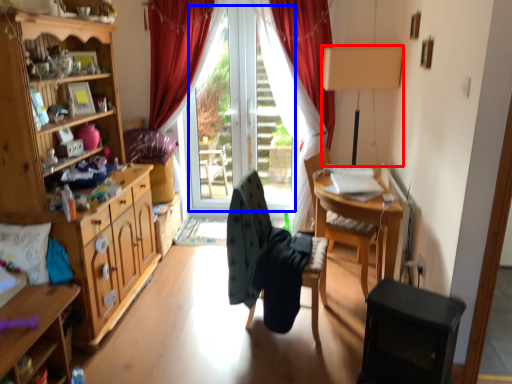
Question: Which object is further to the camera taking this photo, lamp (highlighted by a red box) or window screen (highlighted by a blue box)?

Choices:
 (A) lamp
 (B) window screen

Answer: (B)